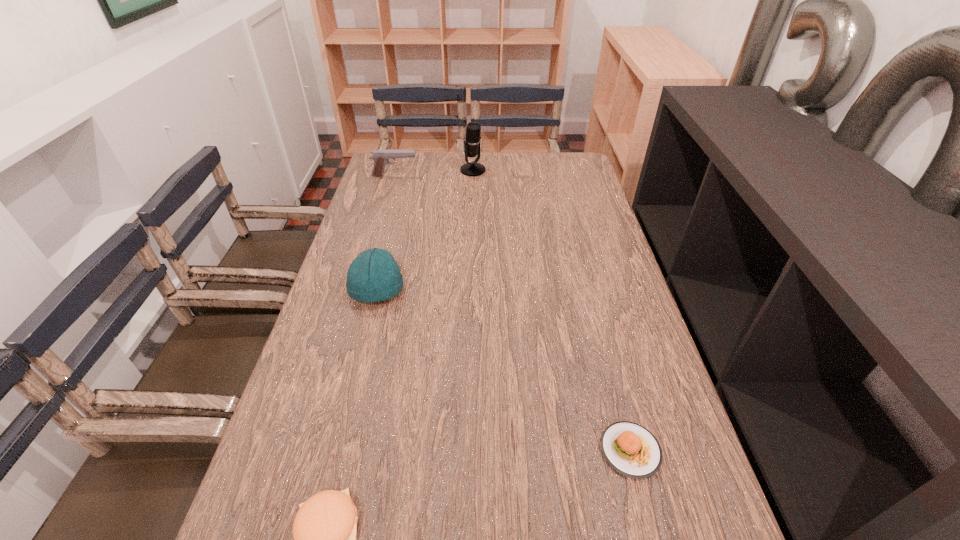
Identify the location of the second object from right to left. coord(472,140).

What are the coordinates of `microphone` in the screenshot? It's located at (472, 140).

The width and height of the screenshot is (960, 540). What are the coordinates of `beanie` in the screenshot? It's located at (373, 276).

At what (x,y) coordinates should I click in order to perform the action: click on pistol. Please return your answer as a coordinate pair (x, y). Looking at the image, I should click on (381, 157).

At what (x,y) coordinates should I click in order to perform the action: click on the right food. Please return your answer as a coordinate pair (x, y). This screenshot has width=960, height=540. Looking at the image, I should click on (632, 450).

I want to click on the rightmost object, so click(632, 450).

Find the location of a particular element. The image size is (960, 540). free space located 0.140m on the left of the tallest object is located at coordinates (423, 170).

Find the location of a particular element. vacant region located 0.360m on the front of the beanie is located at coordinates (339, 446).

At what (x,y) coordinates should I click in order to perform the action: click on vacant space located at the barrel of the pistol. Please return your answer as a coordinate pair (x, y). Looking at the image, I should click on (482, 176).

What are the coordinates of `vacant space situated on the back of the right food` in the screenshot? It's located at (610, 370).